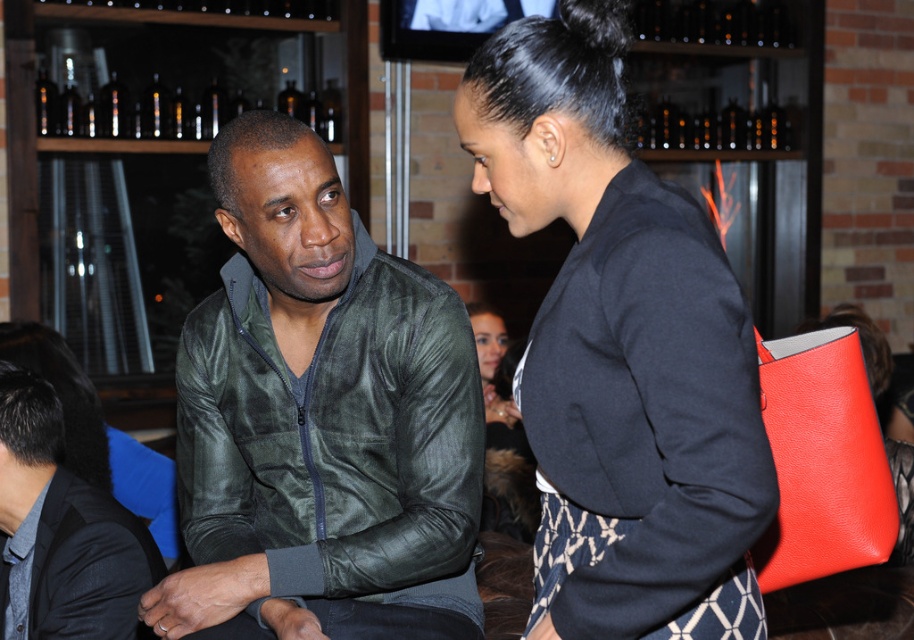
You are a fashion designer observing the scene. You need to determine the spatial relationship between the green leather jacket at center and the black woolen blazer at upper center. Which one is placed higher in the image?

The black woolen blazer at upper center is placed higher in the image than the green leather jacket at center.

You are a bartender in this bar scene. You need to place a new drink order exactly at the point specified. Can you confirm if there is space at point (x=319, y=420) for the drink?

The point (x=319, y=420) is occupied by a green leather jacket at center, so there is no space for the drink order there.

You are standing at the origin of the coordinate system in the bar scene. The green leather jacket at center is located at point (319, 420). If you want to walk directly towards the green leather jacket at center, which direction should you move?

To reach the green leather jacket at center located at point (319, 420) from the origin, you should move northeast since the coordinates are positive in both x and y directions.